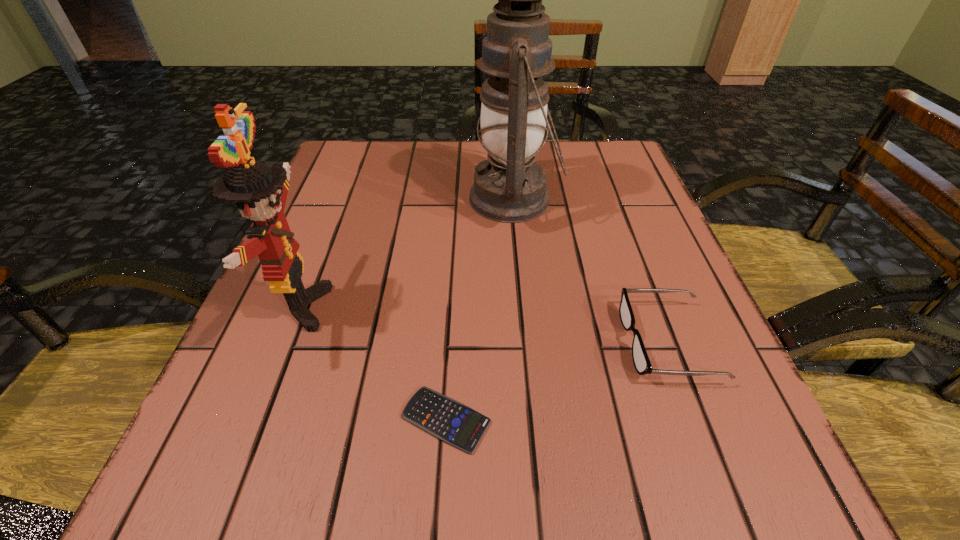
This screenshot has width=960, height=540. I want to click on the farthest object, so 510,187.

What are the coordinates of `oil lamp` in the screenshot? It's located at (510, 187).

Where is `the third shortest object`? The height and width of the screenshot is (540, 960). the third shortest object is located at coordinates (260, 190).

I want to click on the leftmost object, so click(x=260, y=190).

I want to click on the rightmost object, so click(641, 361).

Identify the location of the third tallest object. (641, 361).

Identify the location of calculator. (443, 417).

This screenshot has height=540, width=960. What are the coordinates of `the nearest object` in the screenshot? It's located at (443, 417).

The image size is (960, 540). I want to click on vacant space located on the back of the tallest object, so click(x=508, y=140).

Find the location of a particular element. This screenshot has width=960, height=540. free space located 0.070m on the front-facing side of the third shortest object is located at coordinates (369, 307).